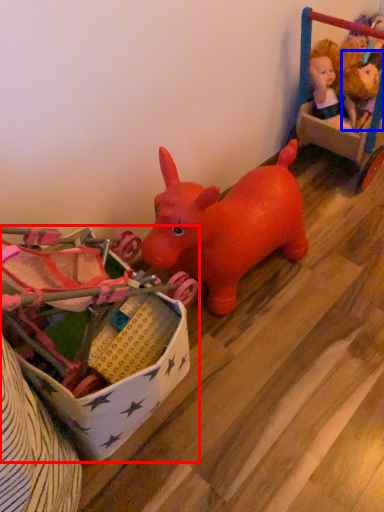
Question: Which object appears farthest to the camera in this image, toy (highlighted by a red box) or toy (highlighted by a blue box)?

Choices:
 (A) toy
 (B) toy

Answer: (B)